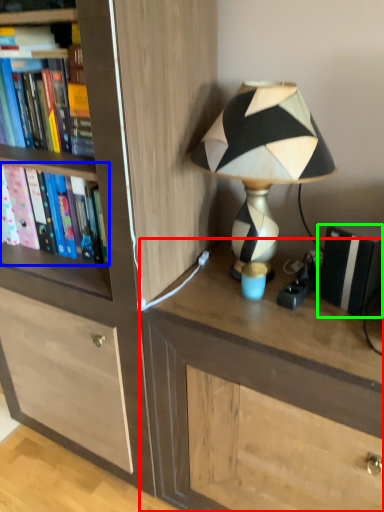
Question: Based on their relative distances, which object is farther from desk (highlighted by a red box)? Choose from book (highlighted by a blue box) and paperback book (highlighted by a green box).

Choices:
 (A) book
 (B) paperback book

Answer: (A)